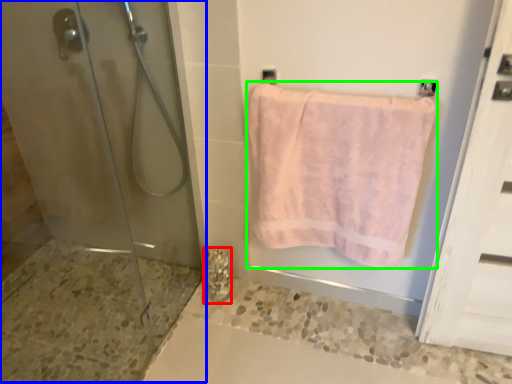
Question: Which is farther away from marble (highlighted by a red box)? shower door (highlighted by a blue box) or towel (highlighted by a green box)?

Choices:
 (A) shower door
 (B) towel

Answer: (B)